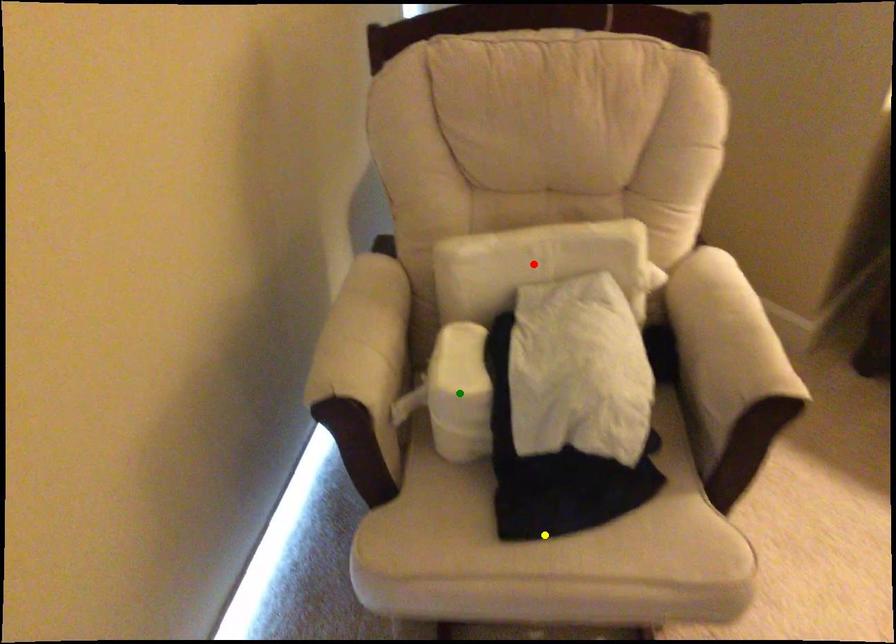
Order these from farthest to nearest:
1. green point
2. yellow point
3. red point

red point, green point, yellow point